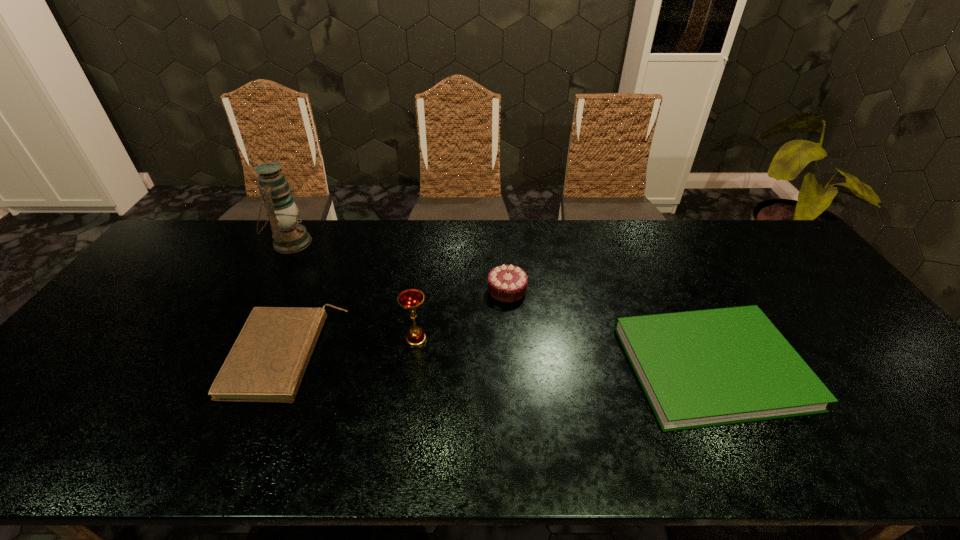
The width and height of the screenshot is (960, 540). I want to click on object that is the third closest to the fourth nearest object, so click(267, 362).

I want to click on object that stands as the fourth closest to the third object from left to right, so click(704, 368).

This screenshot has height=540, width=960. In order to click on vacant region that satisfies the following two spatial constraints: 1. on the front side of the second object from right to left; 2. on the right side of the right paperback book in this screenshot , I will do `click(513, 366)`.

At what (x,y) coordinates should I click in order to perform the action: click on vacant space that satisfies the following two spatial constraints: 1. on the back side of the rightmost object; 2. on the spine side of the left paperback book. Please return your answer as a coordinate pair (x, y). The height and width of the screenshot is (540, 960). Looking at the image, I should click on (706, 355).

Locate an element on the screen. Image resolution: width=960 pixels, height=540 pixels. vacant area that satisfies the following two spatial constraints: 1. on the back side of the second tallest object; 2. on the left side of the fourth nearest object is located at coordinates [x=423, y=290].